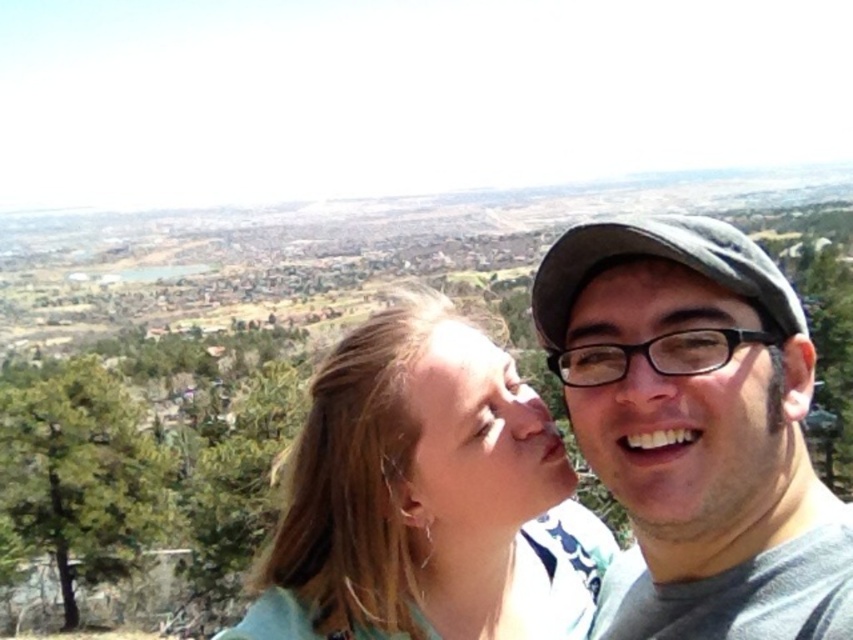
You are taking a photo of two people in a scenic valley. You notice the gray matte cap at upper right and the blonde hair at center. Which object is located more to the right side?

The gray matte cap at upper right is positioned on the right side of blonde hair at center, so it is more to the right side.

You are a photographer trying to capture a closeup shot of both the matte black glasses at center and the smooth skin face at center in the same frame. Given that your camera has a maximum focus range of 15 meters, will you be able to focus on both subjects simultaneously?

The distance between the matte black glasses at center and the smooth skin face at center is 17.39 meters, which exceeds the camera maximum focus range of 15 meters. Therefore, you cannot focus on both subjects simultaneously.